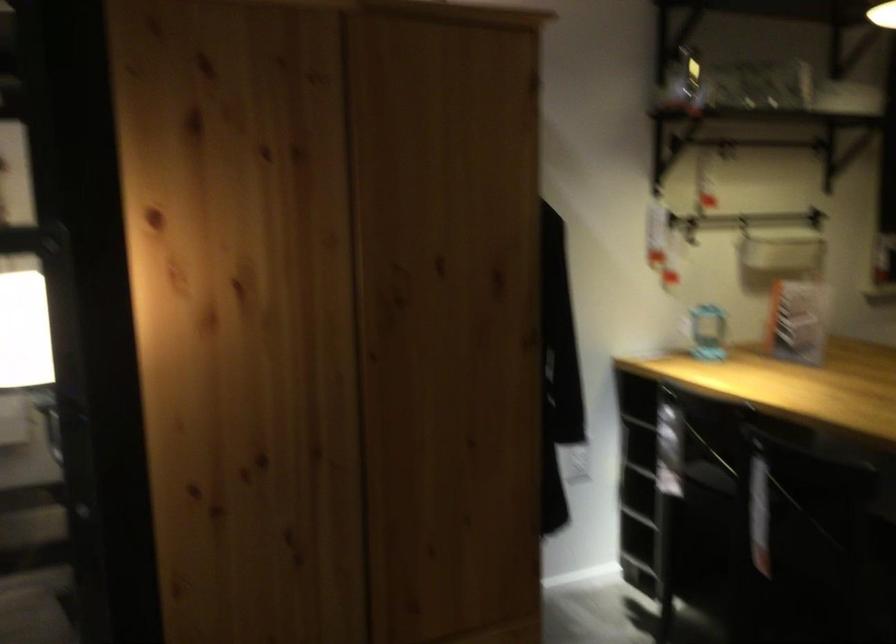
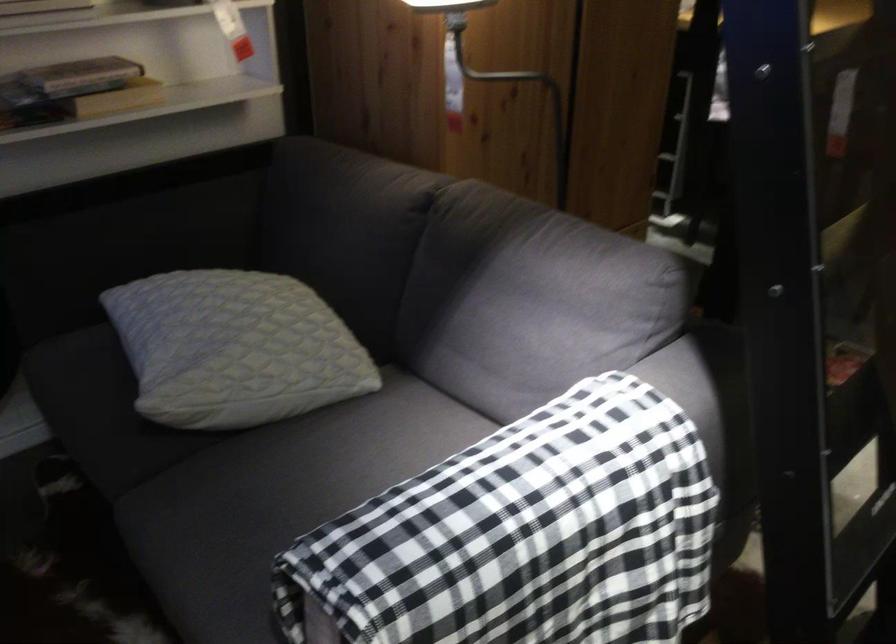
Where in the second image is the point corresponding to point 211,451 from the first image?

(500, 71)